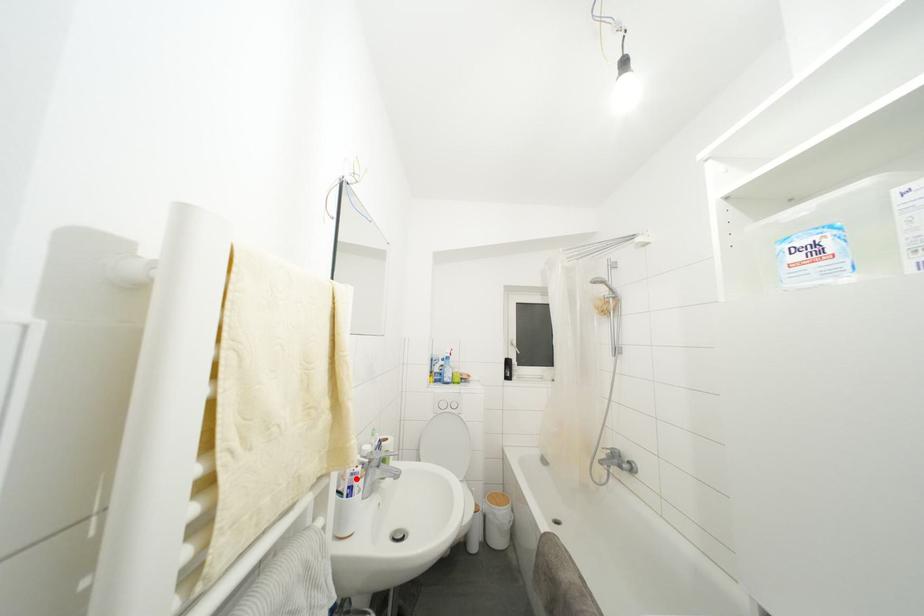
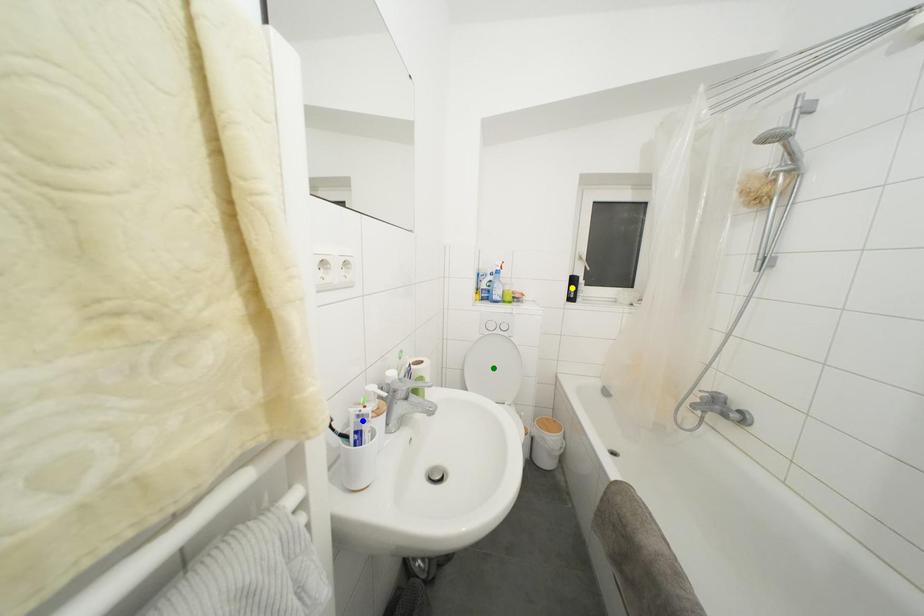
Question: I am providing you with two images of the same scene from different viewpoints. A red point is marked on the first image. You are given multiple points on the second image. Which point in image 2 represents the same 3d spot as the red point in image 1?

Choices:
 (A) green point
 (B) blue point
 (C) yellow point

Answer: (B)